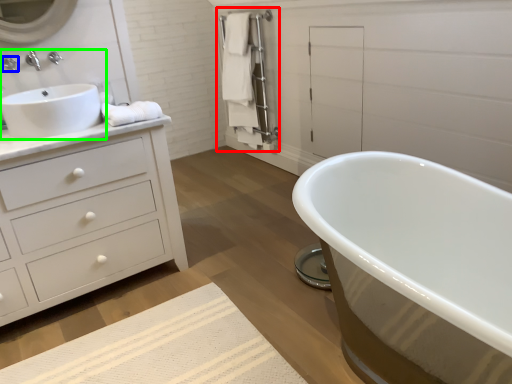
Question: Considering the real-world distances, which object is farthest from closet (highlighted by a red box)? faucet (highlighted by a blue box) or sink (highlighted by a green box)?

Choices:
 (A) faucet
 (B) sink

Answer: (A)